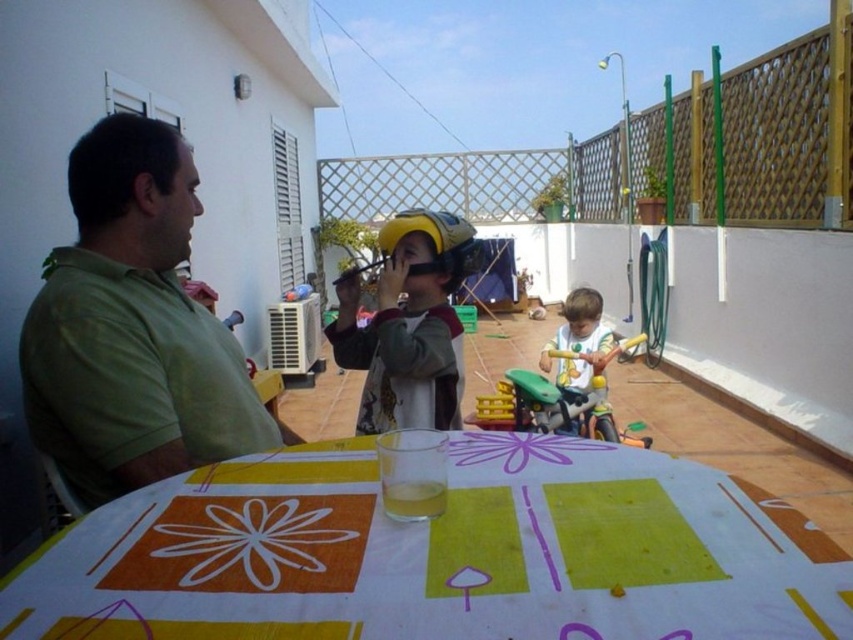
Please look at the yellow matte helmet at center. Where exactly is it located in the image?

The yellow matte helmet at center is located at point coordinates of (408, 324).